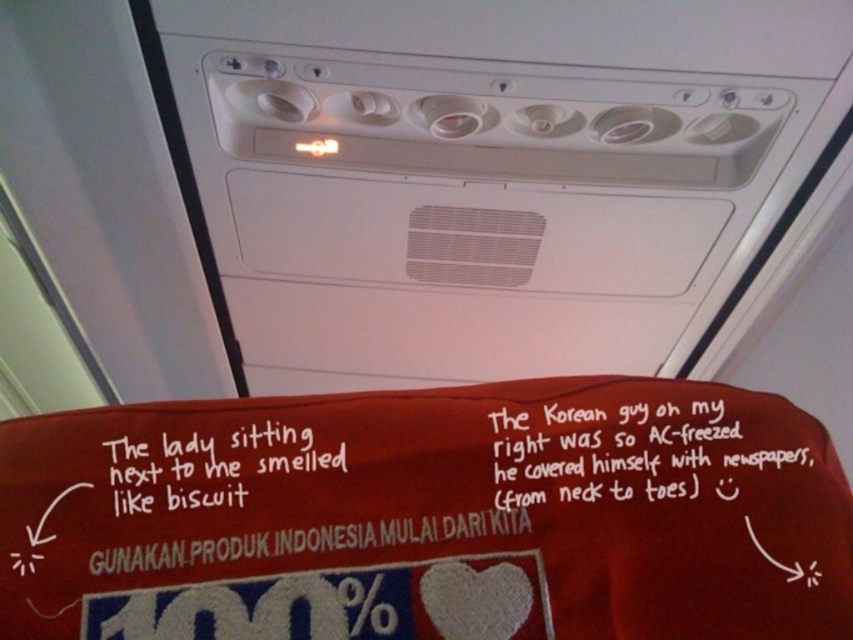
You are a flight attendant checking the overhead panel. You notice the white paper at upper center and the white handwritten text at center. How far apart are these two items from each other?

The white paper at upper center and the white handwritten text at center are 8.71 inches apart.

You are a passenger sitting in the airplane seat and want to adjust the air vent. You see the white plastic air vent at upper center and the white paper at upper center. Which object is located to the left of the other?

The white plastic air vent at upper center is to the left of white paper at upper center.

You are a flight attendant checking the overhead panel in an airplane cabin. You notice the white paper at upper center and the white handwritten text at center. Which object is wider?

The white paper at upper center is wider than the white handwritten text at center.